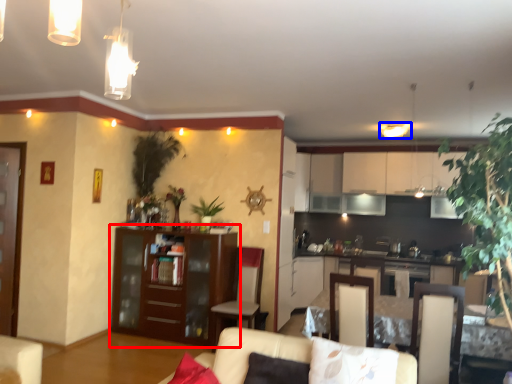
Question: Which of the following is the farthest to the observer, cabinetry (highlighted by a red box) or light fixture (highlighted by a blue box)?

Choices:
 (A) cabinetry
 (B) light fixture

Answer: (B)